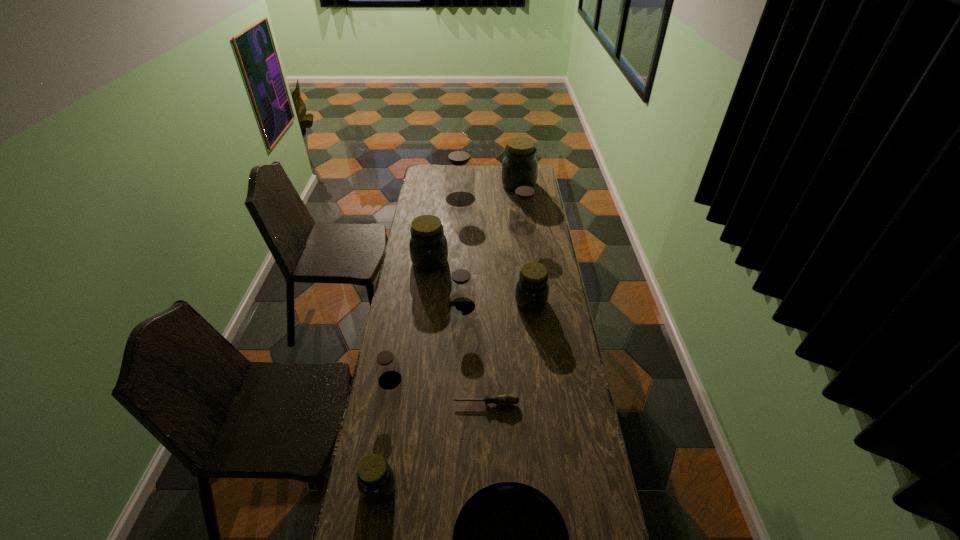
Find the location of a particular element. The image size is (960, 540). object that can be found as the fifth closest to the second smallest green jar is located at coordinates (386, 365).

Find the location of `object that can be found as the ninth closest to the smallest green jar`. object that can be found as the ninth closest to the smallest green jar is located at coordinates (519, 167).

Point out which jar is positioned as the fifth nearest to the third biggest brown jar. Please provide its 2D coordinates. Your answer should be formatted as a tuple, i.e. [(x, y)], where the tuple contains the x and y coordinates of a point satisfying the conditions above.

[(375, 478)]

Find the location of `jar that stands as the fifth closest to the farthest brown jar`. jar that stands as the fifth closest to the farthest brown jar is located at coordinates (461, 287).

Identify which brown jar is located as the third nearest to the second shortest object. Please provide its 2D coordinates. Your answer should be formatted as a tuple, i.e. [(x, y)], where the tuple contains the x and y coordinates of a point satisfying the conditions above.

[(523, 205)]

Select which brown jar appears as the closest to the rightmost brown jar. Please provide its 2D coordinates. Your answer should be formatted as a tuple, i.e. [(x, y)], where the tuple contains the x and y coordinates of a point satisfying the conditions above.

[(459, 173)]

I want to click on green jar identified as the third closest to the farthest brown jar, so click(x=532, y=288).

Identify which green jar is the second nearest to the third biggest green jar. Please provide its 2D coordinates. Your answer should be formatted as a tuple, i.e. [(x, y)], where the tuple contains the x and y coordinates of a point satisfying the conditions above.

[(375, 478)]